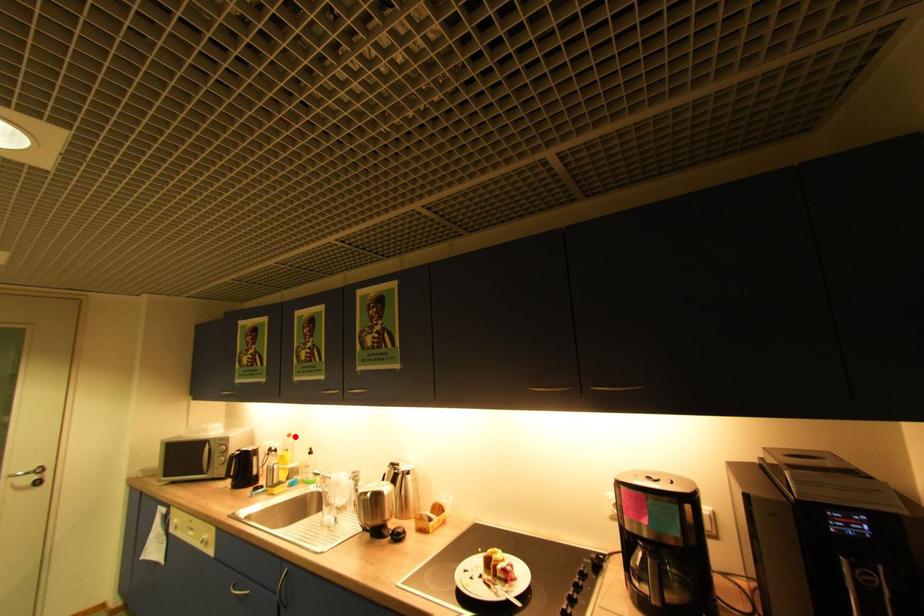
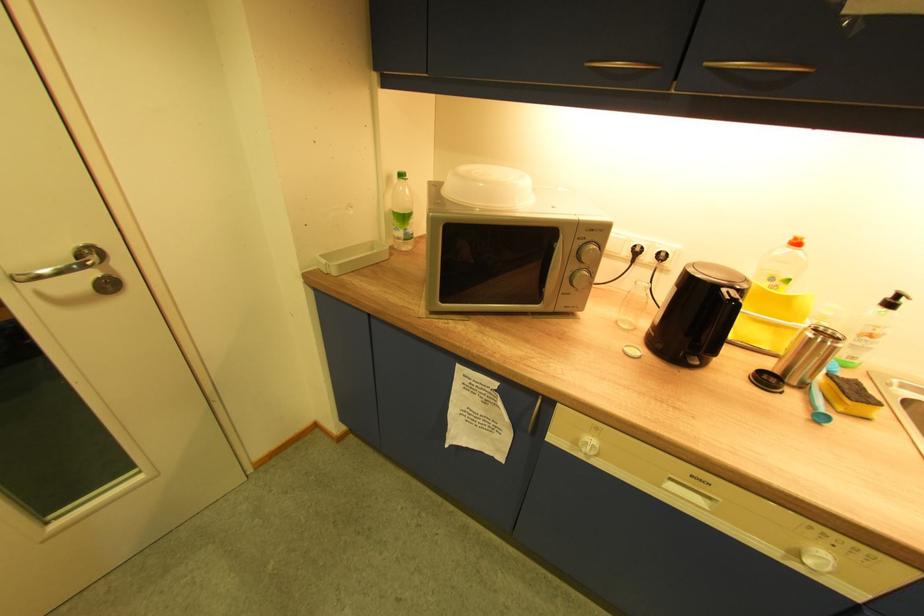
Where in the second image is the point corresponding to the highlighted location from the first image?

(803, 244)